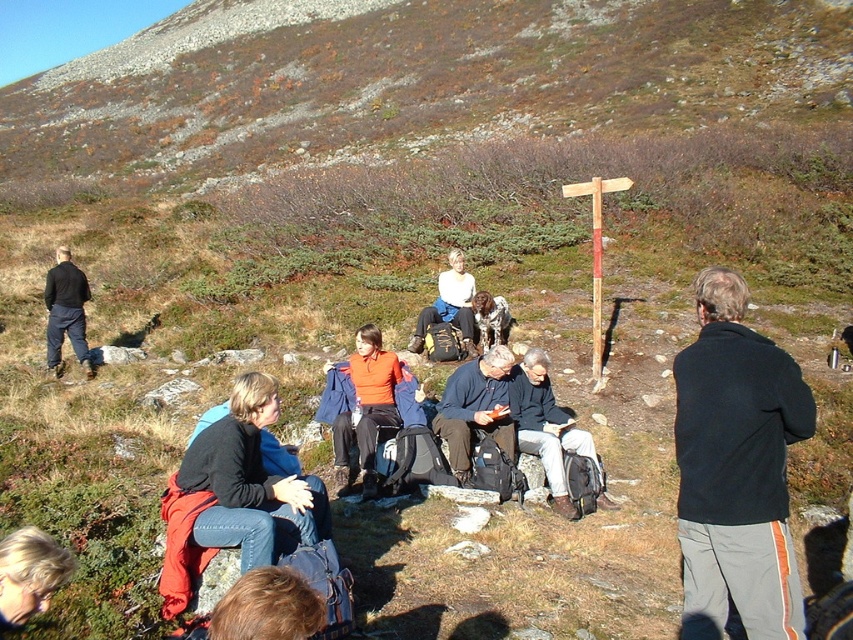
You are a photographer standing at the edge of a hill, aiming to capture a photo of the dark blue jeans at center and the blonde hair at lower center in the same frame. Given that your camera has a maximum focus range of 5 meters, will both subjects be within the focus range?

The dark blue jeans at center is 4.67 meters from blonde hair at lower center. Since the maximum focus range is 5 meters, both subjects are within the 5 meter range and can be captured in focus.

You are a hiker who wants to borrow a jacket from the group. The black fleece jacket at right and the orange fleece jacket at center are available. Which jacket is smaller in size?

The black fleece jacket at right is smaller in size than the orange fleece jacket at center.

You are a photographer trying to capture a photo of the orange fleece jacket at center without the black fleece jacket at right blocking it. Based on their positions, is this possible?

The black fleece jacket at right is in front of the orange fleece jacket at center, so it is blocking the view. To capture the orange fleece jacket at center without obstruction, you would need to move around the black fleece jacket at right to a position where it is no longer in front.